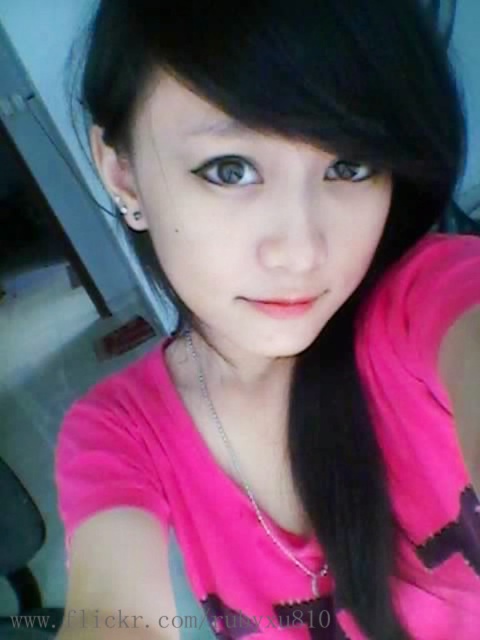
Is blue glossy eye at center further to camera compared to brown matte eye at center?

No, it is not.

Between blue glossy eye at center and brown matte eye at center, which one has less height?

With less height is brown matte eye at center.

I want to click on blue glossy eye at center, so click(228, 170).

Can you confirm if silver chain necklace at center is wider than brown matte eye at center?

Correct, the width of silver chain necklace at center exceeds that of brown matte eye at center.

Which is behind, point (191, 358) or point (336, 172)?

The point (191, 358) is behind.

In order to click on silver chain necklace at center in this screenshot , I will do `click(240, 472)`.

Is silver chain necklace at center positioned before blue glossy eye at center?

That is False.

What are the coordinates of `silver chain necklace at center` in the screenshot? It's located at (240, 472).